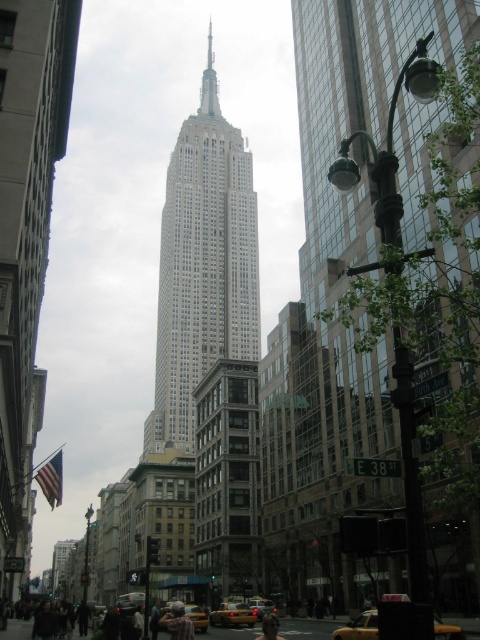
Question: Is yellow matte taxi at center positioned behind yellow matte taxi at lower center?

Choices:
 (A) yes
 (B) no

Answer: (B)

Question: Can you confirm if white smooth skyscraper at center is positioned to the left of yellow metallic taxi cab at center?

Choices:
 (A) no
 (B) yes

Answer: (B)

Question: Which object is closer to the camera taking this photo?

Choices:
 (A) yellow metallic taxi cab at center
 (B) yellow matte taxi at center
 (C) yellow rubber taxi at center

Answer: (B)

Question: Among these objects, which one is nearest to the camera?

Choices:
 (A) yellow metallic taxi cab at center
 (B) yellow rubber taxi at center
 (C) white smooth skyscraper at center

Answer: (B)

Question: Does white smooth skyscraper at center have a lesser width compared to yellow rubber taxi at center?

Choices:
 (A) yes
 (B) no

Answer: (B)

Question: Which point is closer to the camera?

Choices:
 (A) white smooth skyscraper at center
 (B) yellow matte taxi at center
 (C) yellow rubber taxi at center

Answer: (B)